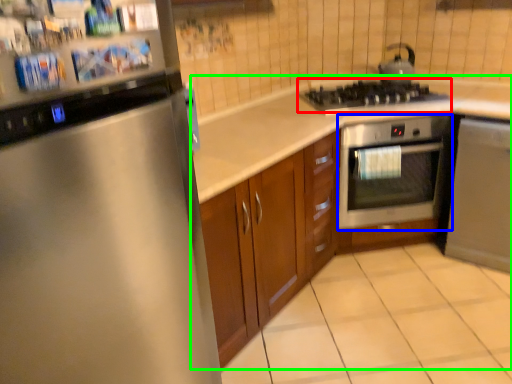
Question: Considering the real-world distances, which object is closest to gas stove (highlighted by a red box)? oven (highlighted by a blue box) or countertop (highlighted by a green box).

Choices:
 (A) oven
 (B) countertop

Answer: (A)